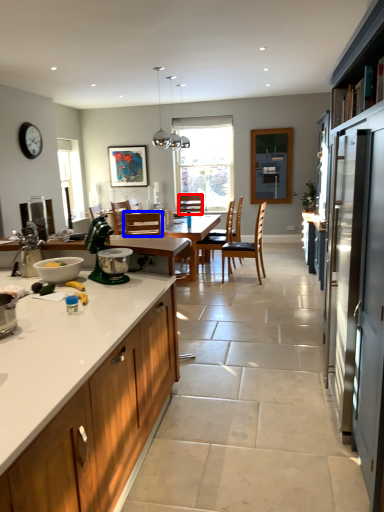
Question: Among these objects, which one is farthest to the camera, chair (highlighted by a red box) or chair (highlighted by a blue box)?

Choices:
 (A) chair
 (B) chair

Answer: (A)